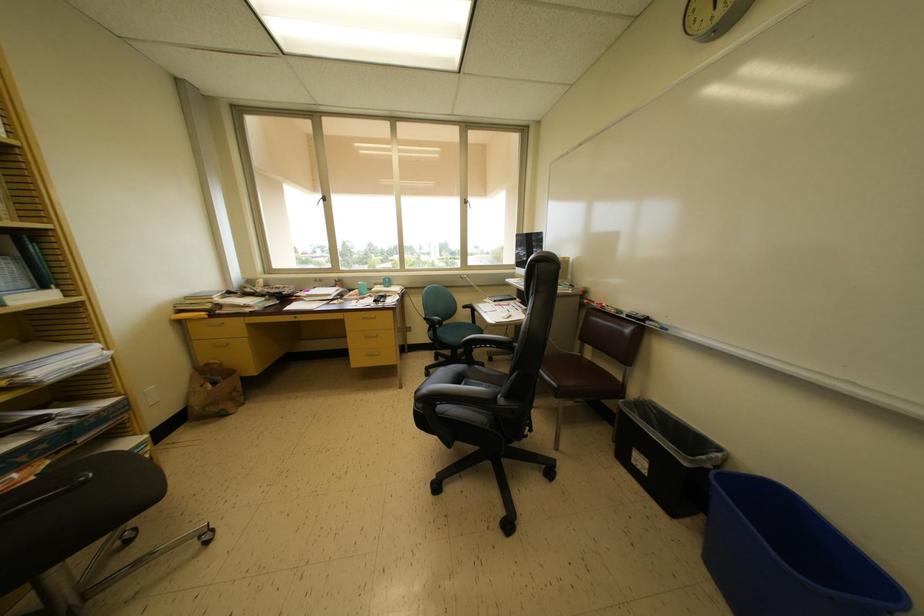
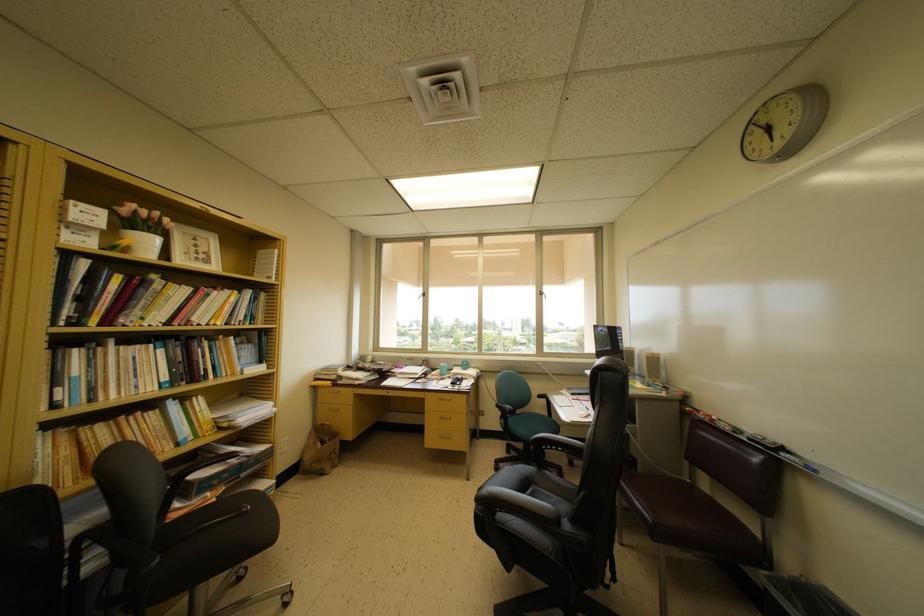
The point at (411, 397) is marked in the first image. Where is the corresponding point in the second image?

(479, 490)